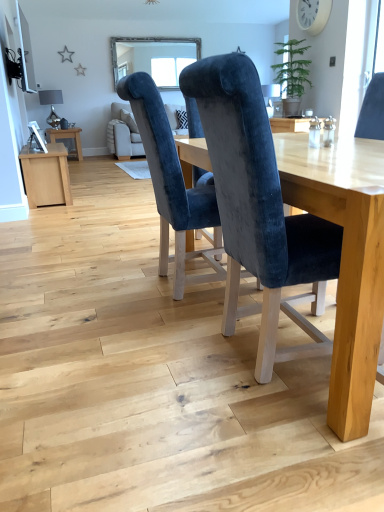
At what (x,y) coordinates should I click in order to perform the action: click on vacant location below velvet blue chair at center, the second chair from the right (from a real-world perspective). Please return your answer as a coordinate pair (x, y). Looking at the image, I should click on coord(167,290).